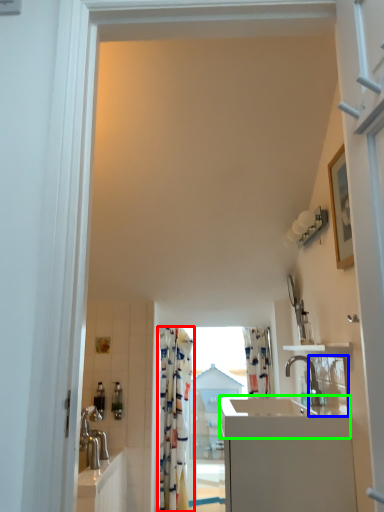
Question: Based on their relative distances, which object is nearer to curtain (highlighted by a red box)? Choose from mirror (highlighted by a blue box) and counter top (highlighted by a green box).

Choices:
 (A) mirror
 (B) counter top

Answer: (A)